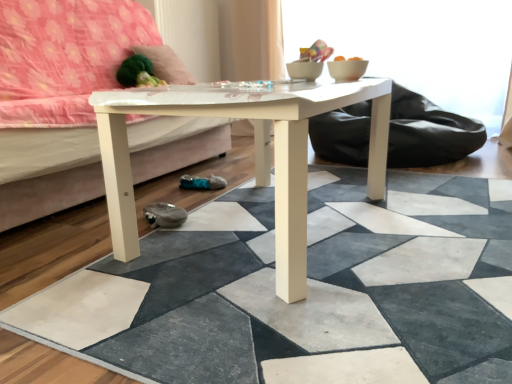
Question: From a real-world perspective, is white glossy studio couch at center above or below white matte tile at center?

Choices:
 (A) below
 (B) above

Answer: (B)

Question: Do you think white glossy studio couch at center is within white matte tile at center, or outside of it?

Choices:
 (A) outside
 (B) inside

Answer: (A)

Question: Which object is positioned farthest from the white glossy studio couch at center?

Choices:
 (A) white matte tile at center
 (B) white glossy coffee table at center
 (C) velvety green pillow at upper left

Answer: (A)

Question: Estimate the real-world distances between objects in this image. Which object is farther from the white glossy coffee table at center?

Choices:
 (A) white glossy studio couch at center
 (B) velvety green pillow at upper left
 (C) white matte tile at center

Answer: (B)